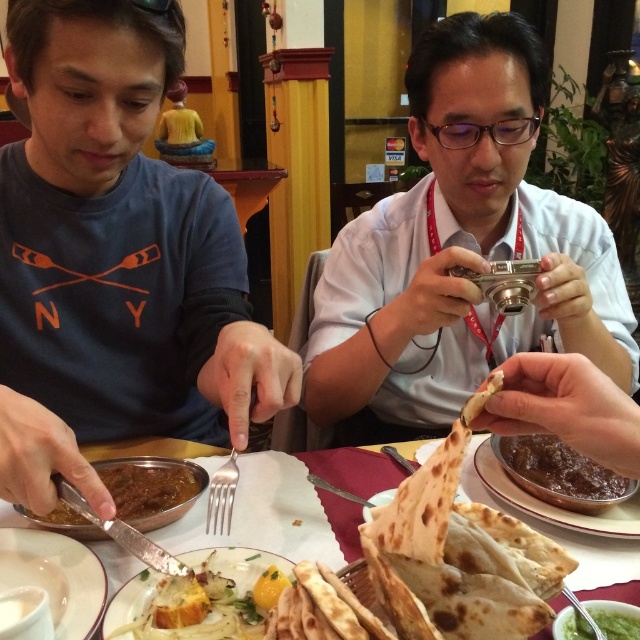
Based on the photo, you are a waiter in the restaurant and need to place a new order for the customer. The customer has a matte blue shirt at left and a green smoothie at center. Which item should you prioritize placing closer to the customer to ensure it is easily accessible?

The matte blue shirt at left should be prioritized because it is much taller than the green smoothie at center, making it more prominent and likely requiring closer placement for accessibility.

You are a waiter in a restaurant and need to place a new dish on the table. There are two points marked on the table where you can place it. The points are labeled as point (582, 234) and point (83, 593). Based on their positions, which point is located behind the other?

Point (582, 234) is behind point (83, 593).